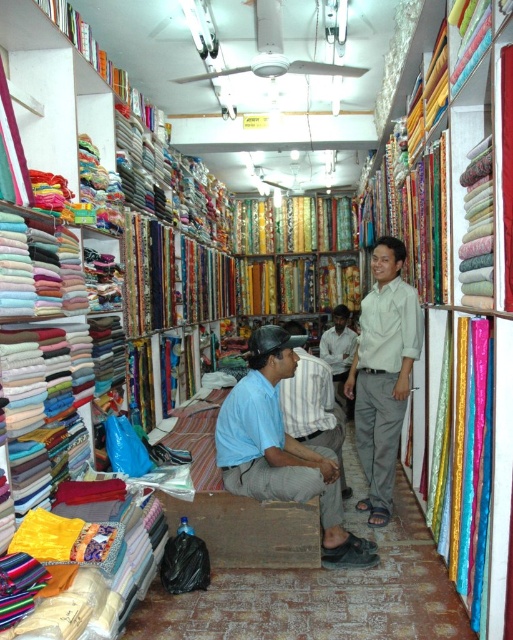
Is blue cotton shirt at center smaller than light brown shirt at center?

Incorrect, blue cotton shirt at center is not smaller in size than light brown shirt at center.

Does blue cotton shirt at center appear over light brown shirt at center?

Actually, blue cotton shirt at center is below light brown shirt at center.

Is point (274, 364) more distant than point (333, 310)?

No, (274, 364) is in front of (333, 310).

Identify the location of blue cotton shirt at center. (282, 451).

Is light beige cotton shirt at center positioned before striped cotton shirt at center?

No, it is not.

Does light beige cotton shirt at center appear on the right side of striped cotton shirt at center?

Yes, light beige cotton shirt at center is to the right of striped cotton shirt at center.

Image resolution: width=513 pixels, height=640 pixels. In order to click on light beige cotton shirt at center in this screenshot , I will do `click(384, 372)`.

Does striped cotton shirt at center have a smaller size compared to light brown shirt at center?

Incorrect, striped cotton shirt at center is not smaller in size than light brown shirt at center.

I want to click on striped cotton shirt at center, so click(313, 408).